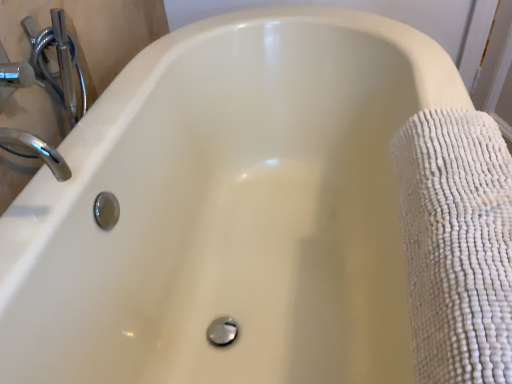
Question: Does chrome/metallic faucet at upper left have a larger size compared to white textured towel at right?

Choices:
 (A) no
 (B) yes

Answer: (A)

Question: Is chrome/metallic faucet at upper left located outside white textured towel at right?

Choices:
 (A) no
 (B) yes

Answer: (B)

Question: From a real-world perspective, does chrome/metallic faucet at upper left stand above white textured towel at right?

Choices:
 (A) yes
 (B) no

Answer: (A)

Question: From the image's perspective, is chrome/metallic faucet at upper left located beneath white textured towel at right?

Choices:
 (A) yes
 (B) no

Answer: (B)

Question: Is chrome/metallic faucet at upper left directly adjacent to white textured towel at right?

Choices:
 (A) no
 (B) yes

Answer: (A)

Question: Does chrome/metallic faucet at upper left have a smaller size compared to white textured towel at right?

Choices:
 (A) yes
 (B) no

Answer: (A)

Question: Does white textured towel at right have a lesser height compared to chrome/metallic faucet at upper left?

Choices:
 (A) no
 (B) yes

Answer: (A)

Question: From the image's perspective, is white textured towel at right located beneath chrome/metallic faucet at upper left?

Choices:
 (A) yes
 (B) no

Answer: (A)

Question: Does white textured towel at right appear on the right side of chrome/metallic faucet at upper left?

Choices:
 (A) yes
 (B) no

Answer: (A)

Question: Are white textured towel at right and chrome/metallic faucet at upper left far apart?

Choices:
 (A) no
 (B) yes

Answer: (A)

Question: Is white textured towel at right located outside chrome/metallic faucet at upper left?

Choices:
 (A) no
 (B) yes

Answer: (B)

Question: Could you tell me if white textured towel at right is turned towards chrome/metallic faucet at upper left?

Choices:
 (A) no
 (B) yes

Answer: (A)

Question: From a real-world perspective, is chrome/metallic faucet at upper left above or below white textured towel at right?

Choices:
 (A) below
 (B) above

Answer: (B)